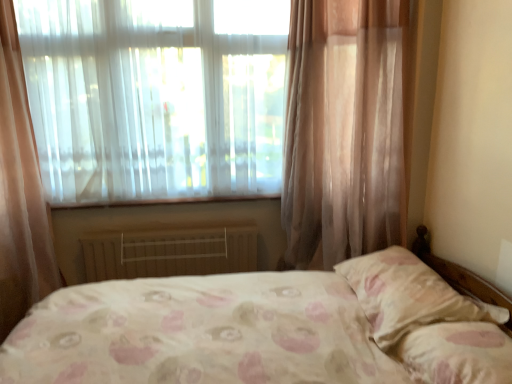
Question: From a real-world perspective, is translucent fabric at upper left on pink floral fabric pillow at lower right, which is the second pillow in back-to-front order?

Choices:
 (A) yes
 (B) no

Answer: (A)

Question: Does translucent fabric at upper left have a smaller size compared to pink floral fabric pillow at lower right, which is the second pillow in back-to-front order?

Choices:
 (A) no
 (B) yes

Answer: (A)

Question: Could you tell me if translucent fabric at upper left is turned towards pink floral fabric pillow at lower right, the 1th pillow from the front?

Choices:
 (A) yes
 (B) no

Answer: (A)

Question: Is translucent fabric at upper left thinner than pink floral fabric pillow at lower right, the 1th pillow from the front?

Choices:
 (A) yes
 (B) no

Answer: (A)

Question: Considering the relative sizes of translucent fabric at upper left and pink floral fabric pillow at lower right, which is the second pillow in back-to-front order, in the image provided, is translucent fabric at upper left wider than pink floral fabric pillow at lower right, which is the second pillow in back-to-front order,?

Choices:
 (A) yes
 (B) no

Answer: (B)

Question: Is translucent fabric at upper left positioned beyond the bounds of pink floral fabric pillow at lower right, the 1th pillow from the front?

Choices:
 (A) no
 (B) yes

Answer: (B)

Question: Is white painted metal radiator at lower center facing towards pink floral fabric pillow at right, positioned as the first pillow in back-to-front order?

Choices:
 (A) yes
 (B) no

Answer: (A)

Question: Considering the relative sizes of white painted metal radiator at lower center and pink floral fabric pillow at right, positioned as the first pillow in back-to-front order, in the image provided, is white painted metal radiator at lower center taller than pink floral fabric pillow at right, positioned as the first pillow in back-to-front order,?

Choices:
 (A) yes
 (B) no

Answer: (A)

Question: Is white painted metal radiator at lower center closer to camera compared to pink floral fabric pillow at right, positioned as the first pillow in back-to-front order?

Choices:
 (A) no
 (B) yes

Answer: (A)

Question: Does white painted metal radiator at lower center have a greater width compared to pink floral fabric pillow at right, the 2th pillow in the front-to-back sequence?

Choices:
 (A) no
 (B) yes

Answer: (A)

Question: Is white painted metal radiator at lower center oriented away from pink floral fabric pillow at right, the 2th pillow in the front-to-back sequence?

Choices:
 (A) yes
 (B) no

Answer: (B)

Question: Does white painted metal radiator at lower center have a lesser height compared to pink floral fabric pillow at right, the 2th pillow in the front-to-back sequence?

Choices:
 (A) yes
 (B) no

Answer: (B)

Question: From the image's perspective, is pink floral fabric pillow at lower right, the 1th pillow from the front, above white painted metal radiator at lower center?

Choices:
 (A) yes
 (B) no

Answer: (B)